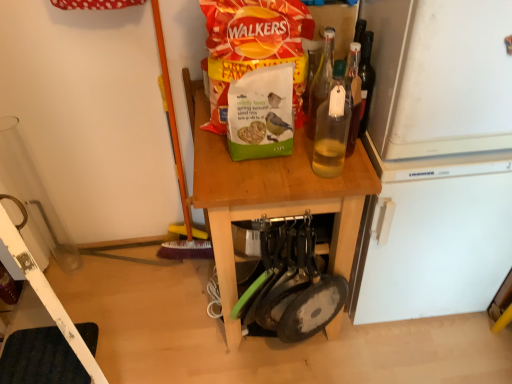
Question: Which is correct: green matte birdseed packet at center is inside transparent glass bottle at center, which appears as the first bottle when viewed from the front, or outside of it?

Choices:
 (A) inside
 (B) outside

Answer: (B)

Question: Visually, is green matte birdseed packet at center positioned to the left or to the right of transparent glass bottle at center, the second bottle when ordered from back to front?

Choices:
 (A) right
 (B) left

Answer: (B)

Question: Based on their relative distances, which object is farther from the white matte refrigerator at right?

Choices:
 (A) transparent glass bottle at center, which appears as the first bottle when viewed from the front
 (B) white plastic ladder at lower left
 (C) green matte birdseed packet at center
 (D) wooden table at center
 (E) translucent glass bottle at center, which appears as the 2th bottle when viewed from the front

Answer: (B)

Question: Estimate the real-world distances between objects in this image. Which object is farther from the white matte refrigerator at right?

Choices:
 (A) green matte birdseed packet at center
 (B) translucent glass bottle at center, the first bottle in the back-to-front sequence
 (C) transparent glass bottle at center, which appears as the first bottle when viewed from the front
 (D) white plastic ladder at lower left
 (E) wooden table at center

Answer: (D)